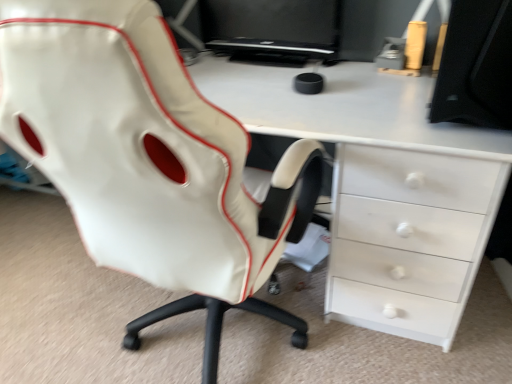
I want to click on black glossy monitor at upper center, so click(273, 30).

At what (x,y) coordinates should I click in order to perform the action: click on white glossy desk at center. Please return your answer as a coordinate pair (x, y). This screenshot has height=384, width=512. Looking at the image, I should click on (383, 187).

The width and height of the screenshot is (512, 384). What are the coordinates of `white leather chair at center` in the screenshot? It's located at (149, 159).

What's the angular difference between black glossy monitor at upper center and white leather chair at center's facing directions?

They differ by 177 degrees in their facing directions.

Considering the relative sizes of black glossy monitor at upper center and white leather chair at center in the image provided, is black glossy monitor at upper center bigger than white leather chair at center?

Actually, black glossy monitor at upper center might be smaller than white leather chair at center.

Image resolution: width=512 pixels, height=384 pixels. What are the coordinates of `chair located on the left of black glossy monitor at upper center` in the screenshot? It's located at [x=149, y=159].

Is black glossy monitor at upper center to the left of black matte monitor at upper right from the viewer's perspective?

Yes.

Is black glossy monitor at upper center far away from black matte monitor at upper right?

They are positioned close to each other.

Is black glossy monitor at upper center completely or partially outside of black matte monitor at upper right?

Yes, black glossy monitor at upper center is outside of black matte monitor at upper right.

The image size is (512, 384). I want to click on computer monitor behind the black matte monitor at upper right, so click(x=273, y=30).

Is point (457, 23) positioned before point (142, 317)?

That is True.

In the scene shown: From the image's perspective, between black matte monitor at upper right and white leather chair at center, who is located below?

white leather chair at center.

Is black matte monitor at upper right situated inside white leather chair at center or outside?

black matte monitor at upper right lies outside white leather chair at center.

Between black matte monitor at upper right and white leather chair at center, which one is positioned in front?

Positioned in front is white leather chair at center.

Does white glossy desk at center turn towards white leather chair at center?

Yes, white glossy desk at center is oriented towards white leather chair at center.

Which object is thinner, white glossy desk at center or white leather chair at center?

With smaller width is white glossy desk at center.

How different are the orientations of white glossy desk at center and white leather chair at center in degrees?

The angular difference between white glossy desk at center and white leather chair at center is 178 degrees.

Between white glossy desk at center and white leather chair at center, which one is positioned in front?

white leather chair at center is more forward.

Which is in front, white leather chair at center or white glossy desk at center?

white leather chair at center is in front.

Is white leather chair at center positioned far away from white glossy desk at center?

No, white leather chair at center is not far away from white glossy desk at center.

Considering the sizes of objects white leather chair at center and white glossy desk at center in the image provided, who is smaller, white leather chair at center or white glossy desk at center?

Smaller between the two is white leather chair at center.

Considering the sizes of objects white leather chair at center and white glossy desk at center in the image provided, who is thinner, white leather chair at center or white glossy desk at center?

With smaller width is white glossy desk at center.

Considering the relative sizes of black matte monitor at upper right and black glossy monitor at upper center in the image provided, is black matte monitor at upper right taller than black glossy monitor at upper center?

Yes.

From the image's perspective, does black matte monitor at upper right appear lower than black glossy monitor at upper center?

Yes, from the image's perspective, black matte monitor at upper right is below black glossy monitor at upper center.

Between black matte monitor at upper right and black glossy monitor at upper center, which one is positioned in front?

Positioned in front is black matte monitor at upper right.

In the scene shown: From the image's perspective, relative to white glossy desk at center, is black glossy monitor at upper center above or below?

Based on their image positions, black glossy monitor at upper center is located above white glossy desk at center.

From a real-world perspective, is black glossy monitor at upper center physically below white glossy desk at center?

Incorrect, from a real-world perspective, black glossy monitor at upper center is higher than white glossy desk at center.

Is black glossy monitor at upper center positioned far away from white glossy desk at center?

No, black glossy monitor at upper center is not far from white glossy desk at center.

This screenshot has height=384, width=512. What are the coordinates of `chair located below the black glossy monitor at upper center (from the image's perspective)` in the screenshot? It's located at (149, 159).

I want to click on computer monitor located on the left of black matte monitor at upper right, so click(273, 30).

Estimate the real-world distances between objects in this image. Which object is closer to black glossy monitor at upper center, black matte monitor at upper right or white leather chair at center?

Based on the image, black matte monitor at upper right appears to be nearer to black glossy monitor at upper center.

Looking at the image, which one is located further to black matte monitor at upper right, black glossy monitor at upper center or white glossy desk at center?

black glossy monitor at upper center.

Looking at the image, which one is located further to black matte monitor at upper right, black glossy monitor at upper center or white leather chair at center?

black glossy monitor at upper center is further to black matte monitor at upper right.

Looking at the image, which one is located closer to white glossy desk at center, black glossy monitor at upper center or white leather chair at center?

white leather chair at center is closer to white glossy desk at center.

Estimate the real-world distances between objects in this image. Which object is further from black glossy monitor at upper center, black matte monitor at upper right or white glossy desk at center?

black matte monitor at upper right lies further to black glossy monitor at upper center than the other object.

From the image, which object appears to be farther from white glossy desk at center, black matte monitor at upper right or white leather chair at center?

white leather chair at center is positioned further to the anchor white glossy desk at center.

From the image, which object appears to be nearer to white leather chair at center, black glossy monitor at upper center or white glossy desk at center?

white glossy desk at center.

Based on their spatial positions, is white glossy desk at center or black glossy monitor at upper center further from black matte monitor at upper right?

black glossy monitor at upper center is positioned further to the anchor black matte monitor at upper right.

Where is `desk between white leather chair at center and black matte monitor at upper right from left to right`? The image size is (512, 384). desk between white leather chair at center and black matte monitor at upper right from left to right is located at coordinates (383, 187).

Locate an element on the screen. desktop between white leather chair at center and black glossy monitor at upper center along the z-axis is located at coordinates (476, 66).

The width and height of the screenshot is (512, 384). Identify the location of desk located between white leather chair at center and black glossy monitor at upper center in the depth direction. (383, 187).

Where is `desktop between black glossy monitor at upper center and white glossy desk at center in the up-down direction`? The width and height of the screenshot is (512, 384). desktop between black glossy monitor at upper center and white glossy desk at center in the up-down direction is located at coordinates (476, 66).